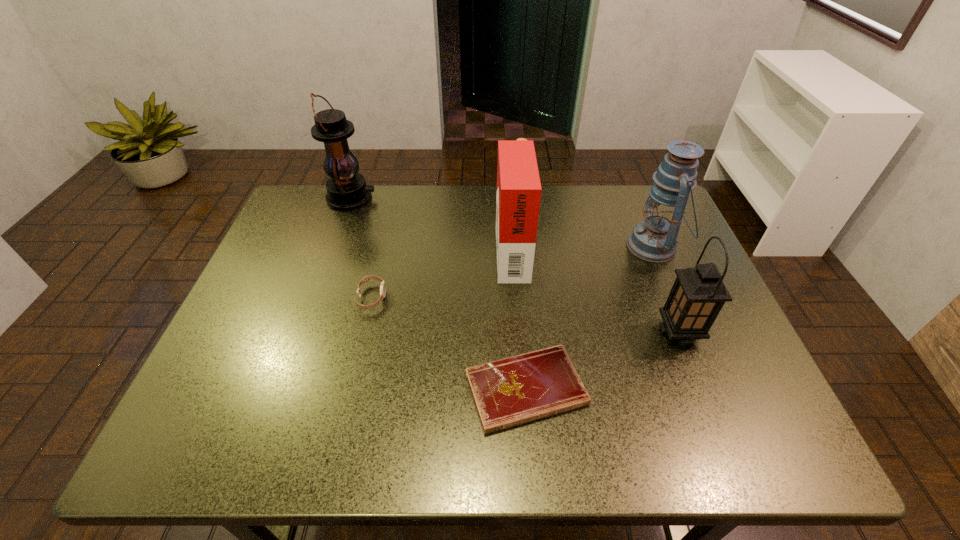
Identify a few places in vacant region located above the leftmost lantern, indicating its light source. Please provide its 2D coordinates. Your answer should be formatted as a tuple, i.e. [(x, y)], where the tuple contains the x and y coordinates of a point satisfying the conditions above.

[(397, 198)]

I want to click on free space located on the front-facing side of the second nearest lantern, so click(493, 246).

You are a GUI agent. You are given a task and a screenshot of the screen. Output one action in this format:
    pyautogui.click(x=<x>, y=<y>)
    Task: Click on the vacant space located 0.220m on the front-facing side of the second nearest lantern
    
    Given the screenshot: What is the action you would take?
    pyautogui.click(x=549, y=246)

The width and height of the screenshot is (960, 540). Identify the location of vacant space situated 0.080m on the front-facing side of the second nearest lantern. (599, 246).

Where is `blank space located on the front-facing side of the cigarette case`? The image size is (960, 540). blank space located on the front-facing side of the cigarette case is located at coordinates (425, 249).

At what (x,y) coordinates should I click in order to perform the action: click on free location located on the front-facing side of the cigarette case. Please return your answer as a coordinate pair (x, y). The height and width of the screenshot is (540, 960). Looking at the image, I should click on (468, 249).

This screenshot has height=540, width=960. What are the coordinates of `vacant region located 0.250m on the front-facing side of the cigarette case` in the screenshot? It's located at (407, 249).

Find the location of `vacant space located on the left of the nearest lantern`. vacant space located on the left of the nearest lantern is located at coordinates (527, 332).

Where is `free space located on the face of the fifth tallest object`? free space located on the face of the fifth tallest object is located at coordinates (449, 298).

You are a GUI agent. You are given a task and a screenshot of the screen. Output one action in this format:
    pyautogui.click(x=<x>, y=<y>)
    Task: Click on the vacant space situated 0.380m on the left of the shortest object
    
    Given the screenshot: What is the action you would take?
    pyautogui.click(x=284, y=390)